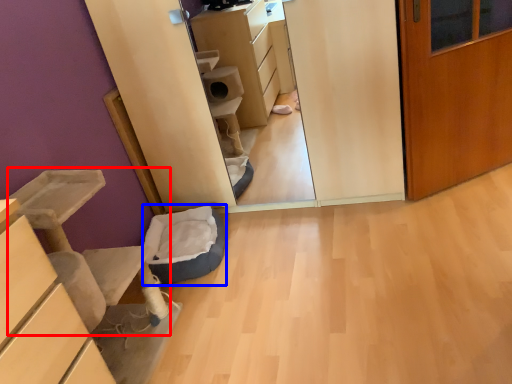
Question: Which point is closer to the camera, furniture (highlighted by a red box) or cat bed (highlighted by a blue box)?

Choices:
 (A) furniture
 (B) cat bed

Answer: (A)